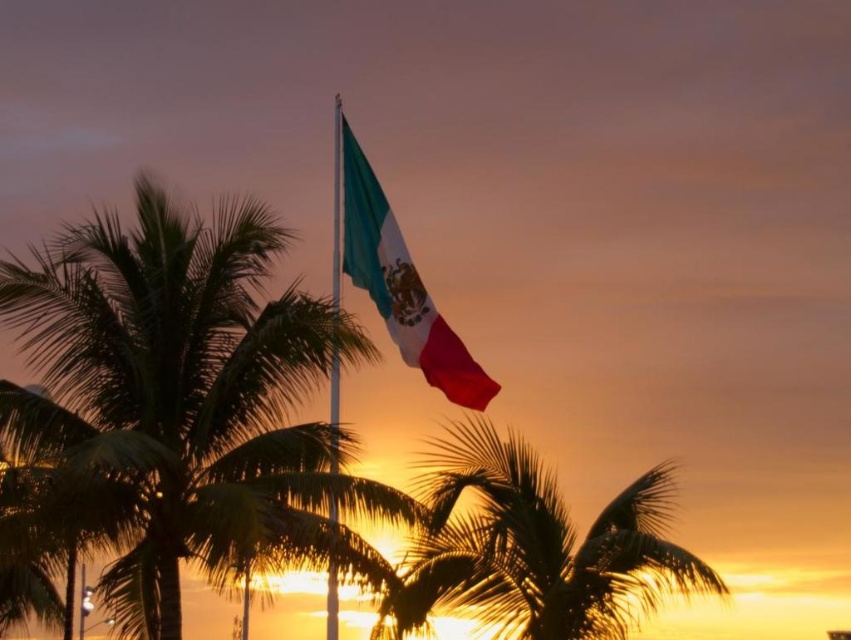
You are an artist trying to paint the sunset scene. You need to decide the placement of the silky gold palm tree at center and the metallic flag pole at center. According to the scene, which object is positioned lower in the image?

The silky gold palm tree at center is positioned below the metallic flag pole at center, so it is lower in the image.

You are an artist sketching the sunset scene. You need to place the silky fabric flag at center and the metallic flag pole at center accurately. According to the scene, which object is located to the right of the other?

The silky fabric flag at center is positioned on the right side of metallic flag pole at center.